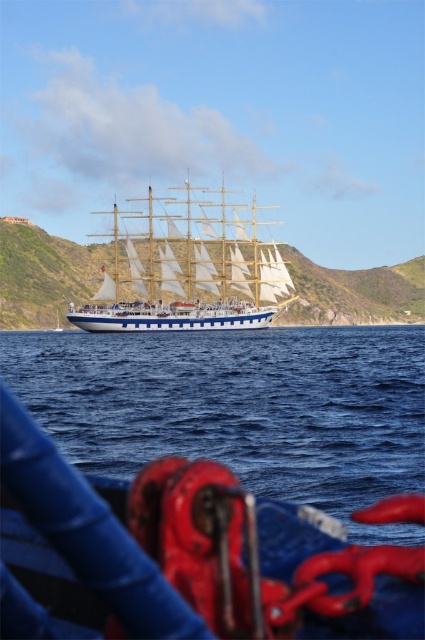
Question: Which of the following is the closest to the observer?

Choices:
 (A) (176, 289)
 (B) (36, 337)

Answer: (A)

Question: Which of the following is the farthest from the observer?

Choices:
 (A) (130, 412)
 (B) (238, 301)

Answer: (B)

Question: Does blue water at center have a larger size compared to white wooden ship at center?

Choices:
 (A) no
 (B) yes

Answer: (A)

Question: Does blue water at center have a larger size compared to white wooden ship at center?

Choices:
 (A) yes
 (B) no

Answer: (B)

Question: Is blue water at center smaller than white wooden ship at center?

Choices:
 (A) no
 (B) yes

Answer: (B)